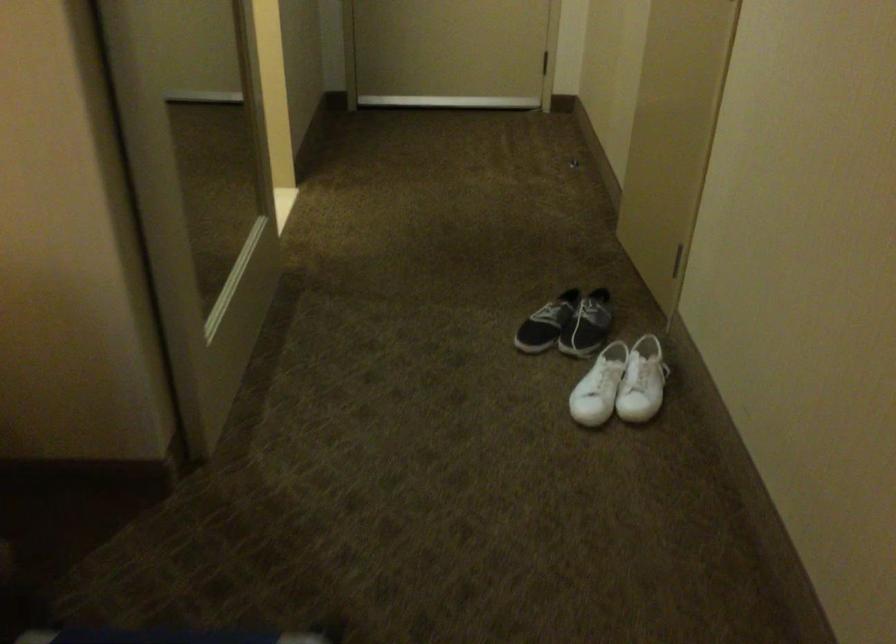
Identify the location of black sneaker. (567, 324).